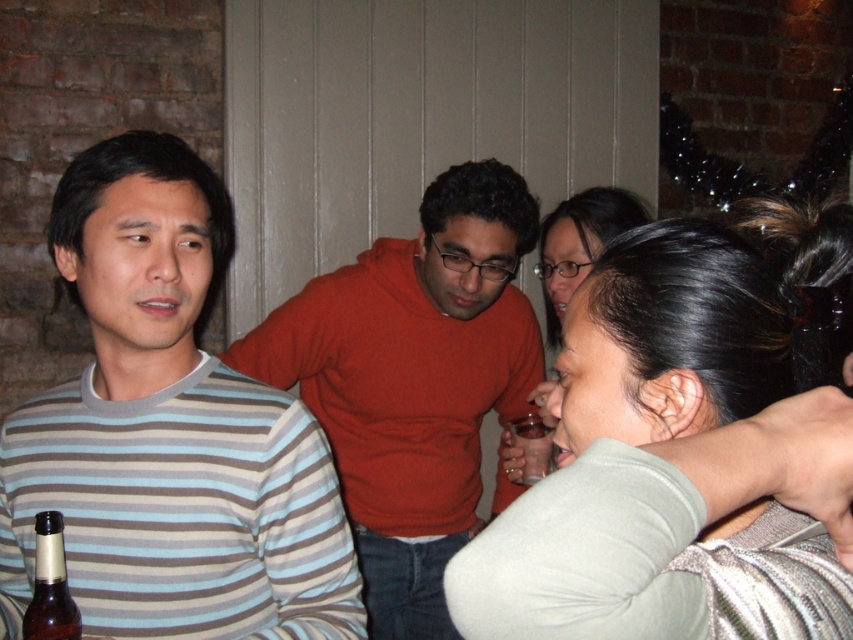
You are organizing a photo shoot and need to arrange the dark gray sweater at lower right and the striped cotton shirt at left based on their sizes. Which one should you place in a larger display area?

The striped cotton shirt at left should be placed in the larger display area since it is bigger than the dark gray sweater at lower right.

You are a photographer setting up for a group photo. You need to ensure that the dark gray sweater at lower right and the striped cotton shirt at left are at least 20 inches apart for proper framing. Based on the scene, can you confirm if they meet this requirement?

The distance between the dark gray sweater at lower right and the striped cotton shirt at left is 21.12 inches, which exceeds the minimum requirement of 20 inches. Therefore, they are positioned appropriately for the photo setup.

You are a bartender preparing to serve drinks at the party. You have a new customer who is wearing the striped cotton shirt at left and wants to hold their drink. Can they comfortably hold the translucent plastic cup at lower center with one hand?

The striped cotton shirt at left is worn by a person whose hand size cannot be determined from the image. However, the striped cotton shirt at left is larger in width than the translucent plastic cup at lower center, which suggests the cup is small enough to be held comfortably with one hand.